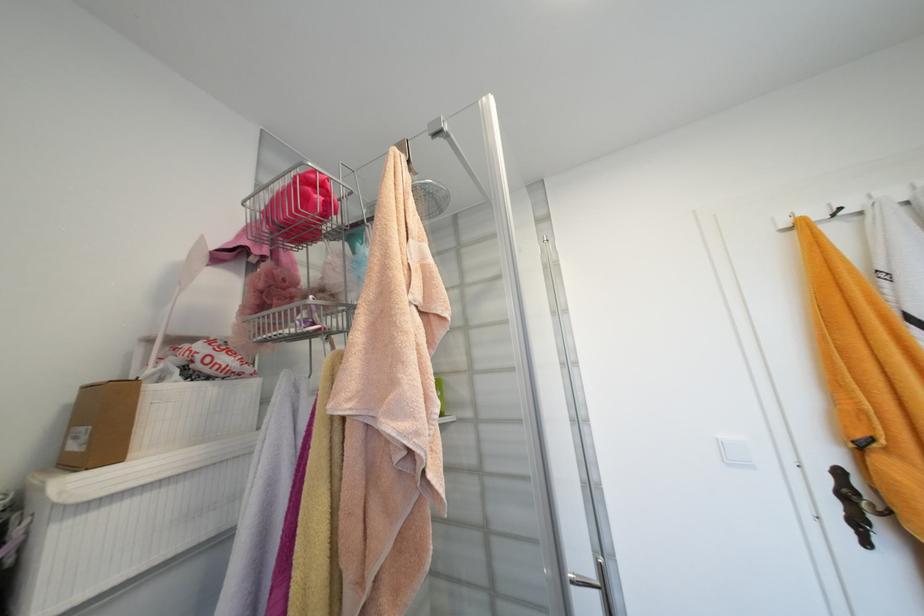
Image resolution: width=924 pixels, height=616 pixels. What do you see at coordinates (355, 192) in the screenshot?
I see `the white basket handle` at bounding box center [355, 192].